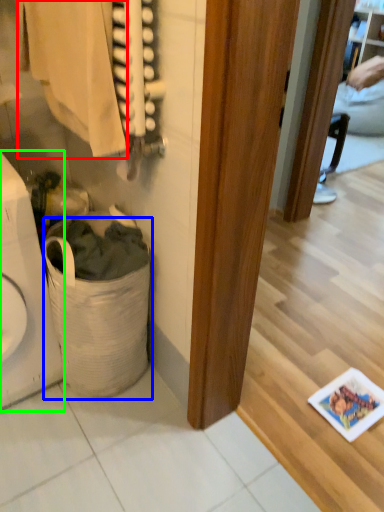
Question: Estimate the real-world distances between objects in this image. Which object is closer to clothing (highlighted by a red box), laundry basket (highlighted by a blue box) or appliance (highlighted by a green box)?

Choices:
 (A) laundry basket
 (B) appliance

Answer: (B)